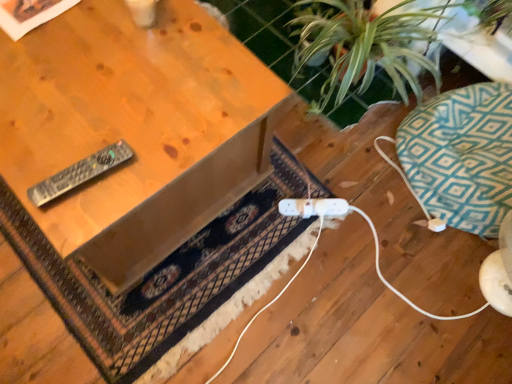
Question: Visually, is dark brown woven rug at center positioned to the left or to the right of teal geometric cushion at right?

Choices:
 (A) left
 (B) right

Answer: (A)

Question: From the image's perspective, is dark brown woven rug at center above or below teal geometric cushion at right?

Choices:
 (A) below
 (B) above

Answer: (A)

Question: Which of these objects is positioned closest to the teal geometric cushion at right?

Choices:
 (A) dark brown woven rug at center
 (B) black plastic remote at left
 (C) wooden table at upper left
 (D) green leafy plant at upper right
 (E) white plastic plug at lower center

Answer: (D)

Question: Which object is the closest to the teal geometric cushion at right?

Choices:
 (A) white plastic plug at lower center
 (B) black plastic remote at left
 (C) green leafy plant at upper right
 (D) dark brown woven rug at center
 (E) wooden table at upper left

Answer: (C)